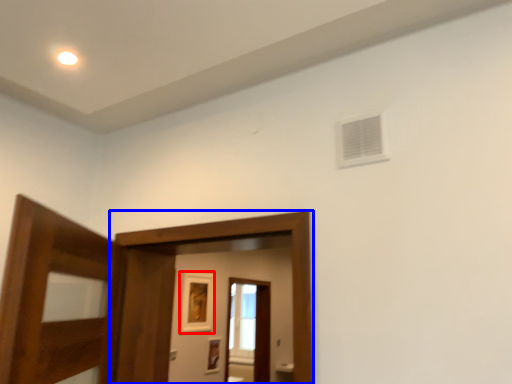
Question: Which object appears closest to the camera in this image, picture frame (highlighted by a red box) or screen door (highlighted by a blue box)?

Choices:
 (A) picture frame
 (B) screen door

Answer: (B)